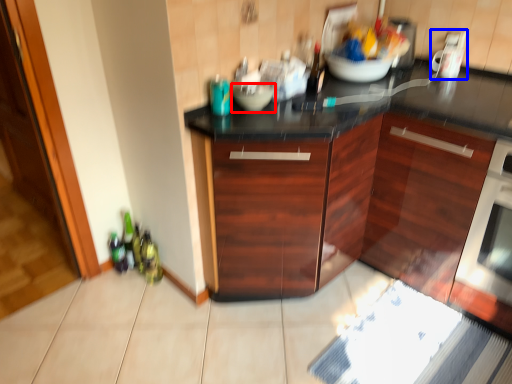
Question: Which of the following is the closest to the observer, bowl (highlighted by a red box) or appliance (highlighted by a blue box)?

Choices:
 (A) bowl
 (B) appliance

Answer: (A)